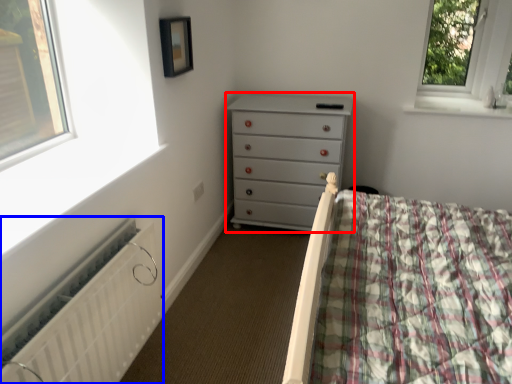
Question: Which object appears closest to the camera in this image, chest of drawers (highlighted by a red box) or radiator (highlighted by a blue box)?

Choices:
 (A) chest of drawers
 (B) radiator

Answer: (B)